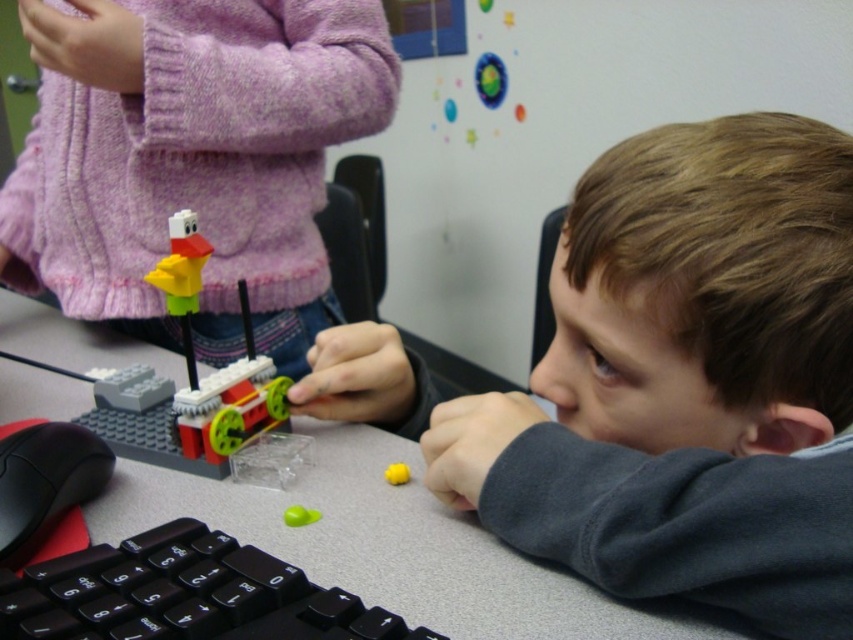
Question: Among these points, which one is farthest from the camera?

Choices:
 (A) (216, 429)
 (B) (86, 616)
 (C) (548, 460)

Answer: (A)

Question: Is brick-like plastic duck at center thinner than green matte ball at center?

Choices:
 (A) yes
 (B) no

Answer: (B)

Question: Is gray matte table at center to the left of green matte ball at center from the viewer's perspective?

Choices:
 (A) yes
 (B) no

Answer: (A)

Question: Which of the following is the farthest from the observer?

Choices:
 (A) (799, 531)
 (B) (299, 310)
 (C) (380, 509)

Answer: (B)

Question: Which of the following is the farthest from the observer?

Choices:
 (A) brick-like plastic duck at center
 (B) smooth gray sweater at center
 (C) matte plastic toy at center

Answer: (C)

Question: In this image, where is green matte ball at center located relative to yellow matte ball at center?

Choices:
 (A) below
 (B) above

Answer: (A)